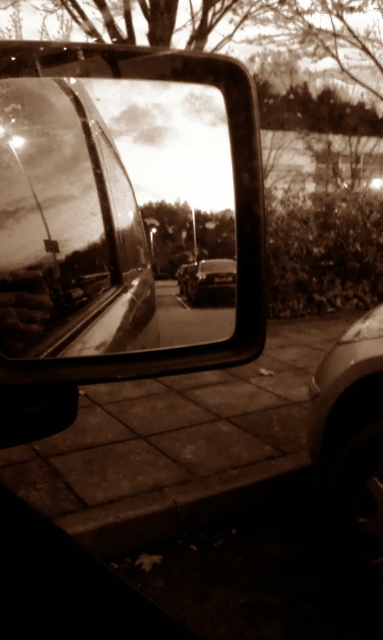
Question: Is metallic car mirror at upper left positioned before shiny black tire at lower right?

Choices:
 (A) yes
 (B) no

Answer: (A)

Question: Can you confirm if metallic car mirror at upper left is positioned below shiny silver car at center?

Choices:
 (A) no
 (B) yes

Answer: (A)

Question: Based on their relative distances, which object is farther from the metallic car mirror at upper left?

Choices:
 (A) shiny black tire at lower right
 (B) shiny silver car at center

Answer: (A)

Question: Does metallic car mirror at upper left appear on the left side of shiny silver car at center?

Choices:
 (A) no
 (B) yes

Answer: (B)

Question: Among these points, which one is farthest from the camera?

Choices:
 (A) (363, 320)
 (B) (129, 204)
 (C) (217, 269)

Answer: (A)

Question: Which point is closer to the camera taking this photo?

Choices:
 (A) (356, 332)
 (B) (183, 186)

Answer: (B)